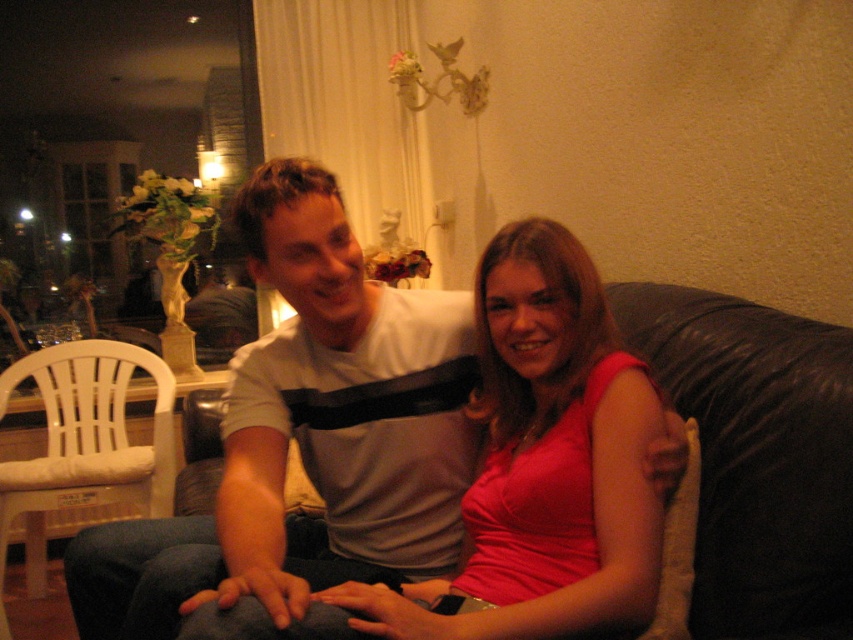
Does point (786, 476) come closer to viewer compared to point (44, 385)?

That is True.

Between point (726, 339) and point (13, 486), which one is positioned behind?

Positioned behind is point (13, 486).

Where is `black leather couch at center`? The image size is (853, 640). black leather couch at center is located at coordinates (757, 456).

At what (x,y) coordinates should I click in order to perform the action: click on black leather couch at center. Please return your answer as a coordinate pair (x, y). Image resolution: width=853 pixels, height=640 pixels. Looking at the image, I should click on (x=757, y=456).

Does gray striped t-shirt at center have a larger size compared to white plastic chair at left?

No.

Who is shorter, gray striped t-shirt at center or white plastic chair at left?

gray striped t-shirt at center

The height and width of the screenshot is (640, 853). What do you see at coordinates (306, 435) in the screenshot? I see `gray striped t-shirt at center` at bounding box center [306, 435].

You are a GUI agent. You are given a task and a screenshot of the screen. Output one action in this format:
    pyautogui.click(x=<x>, y=<y>)
    Task: Click on the gray striped t-shirt at center
    This screenshot has width=853, height=640.
    Given the screenshot: What is the action you would take?
    pyautogui.click(x=306, y=435)

Is gray striped t-shirt at center bigger than black leather couch at center?

Yes.

Who is more distant from viewer, (318,296) or (650,333)?

The point (650,333) is behind.

Between point (256, 200) and point (715, 406), which one is positioned in front?

Point (256, 200)

Image resolution: width=853 pixels, height=640 pixels. I want to click on gray striped t-shirt at center, so click(x=306, y=435).